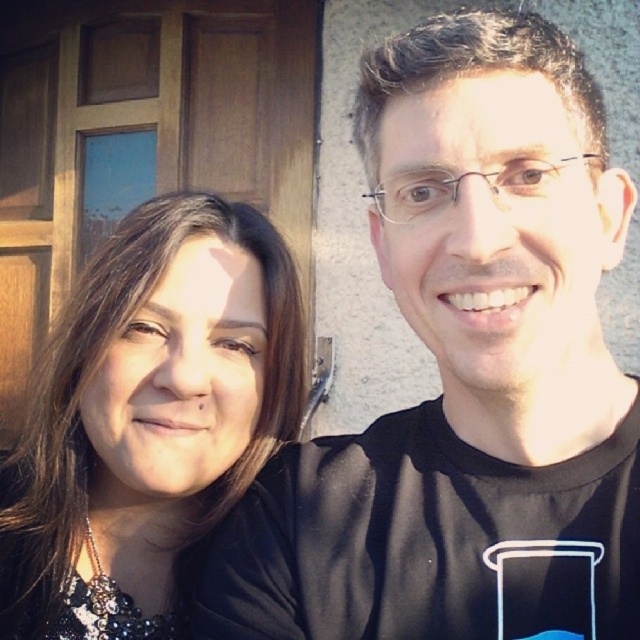
What do you see at coordinates (465, 372) in the screenshot? The height and width of the screenshot is (640, 640). I see `black matte shirt at right` at bounding box center [465, 372].

Is point (577, 298) behind point (227, 324)?

No, it is not.

Which is behind, point (572, 353) or point (244, 401)?

The point (244, 401) is more distant.

Where is `black matte shirt at right`? This screenshot has height=640, width=640. black matte shirt at right is located at coordinates (465, 372).